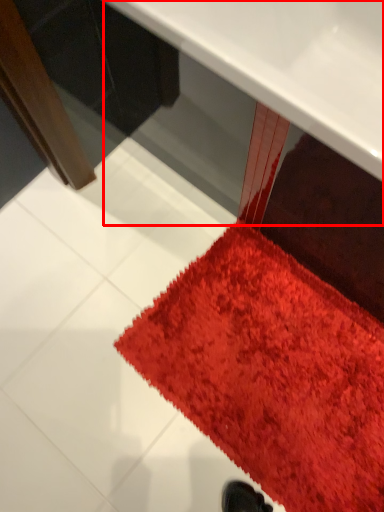
Question: From the image's perspective, what is the correct spatial relationship of table (annotated by the red box) in relation to mat?

Choices:
 (A) below
 (B) above

Answer: (B)